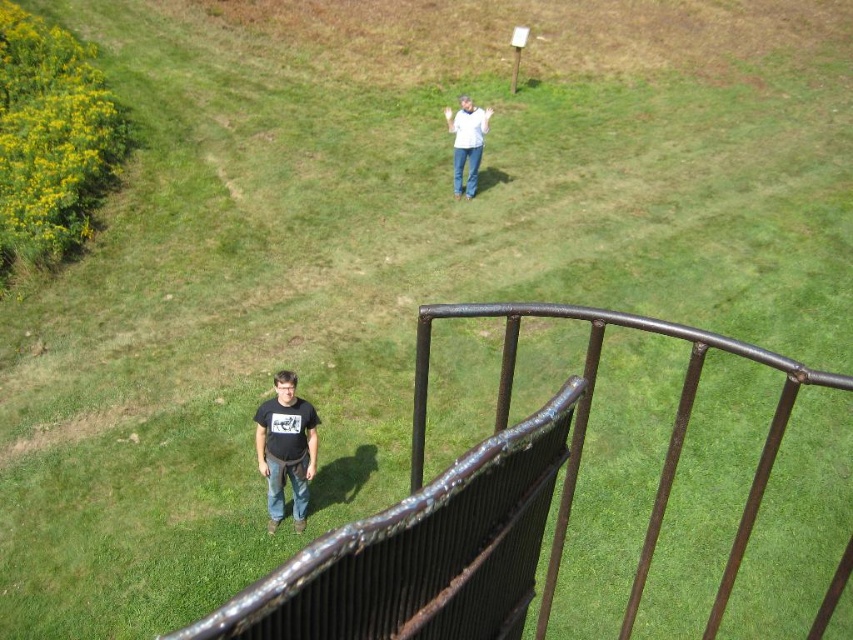
You are looking down from an elevated platform and see the white matte shirt at upper center and the blue denim jeans at lower center. Which one is positioned higher from your viewpoint?

The white matte shirt at upper center is located above the blue denim jeans at lower center, so it is positioned higher from your viewpoint.

You are looking down from an elevated platform and notice two people below. One is wearing a white matte shirt at upper center and the other has blue denim jeans at lower center. Which clothing item appears taller in the image?

The white matte shirt at upper center appears taller than the blue denim jeans at lower center in the image.